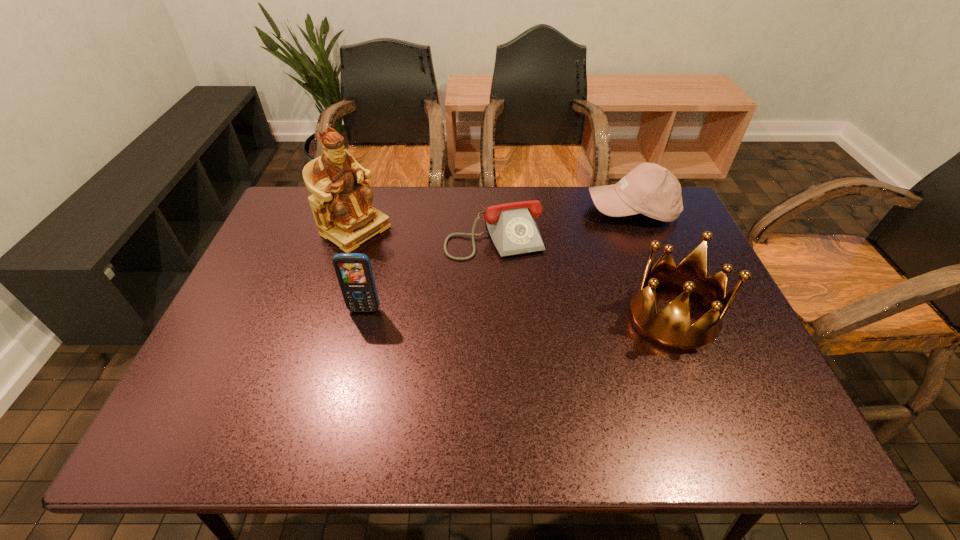
At what (x,y) coordinates should I click in order to perform the action: click on free spot on the desktop that is between the cellular telephone and the crown and is positioned on the front-facing side of the tallest object. Please return your answer as a coordinate pair (x, y). The height and width of the screenshot is (540, 960). Looking at the image, I should click on pos(477,313).

Locate an element on the screen. This screenshot has width=960, height=540. free space on the desktop that is between the cellular telephone and the crown and is positioned on the dial of the third object from left to right is located at coordinates (525, 314).

The height and width of the screenshot is (540, 960). Find the location of `free space on the desktop that is between the cellular telephone and the crown and is positioned on the front-facing side of the second shortest object`. free space on the desktop that is between the cellular telephone and the crown and is positioned on the front-facing side of the second shortest object is located at coordinates (557, 314).